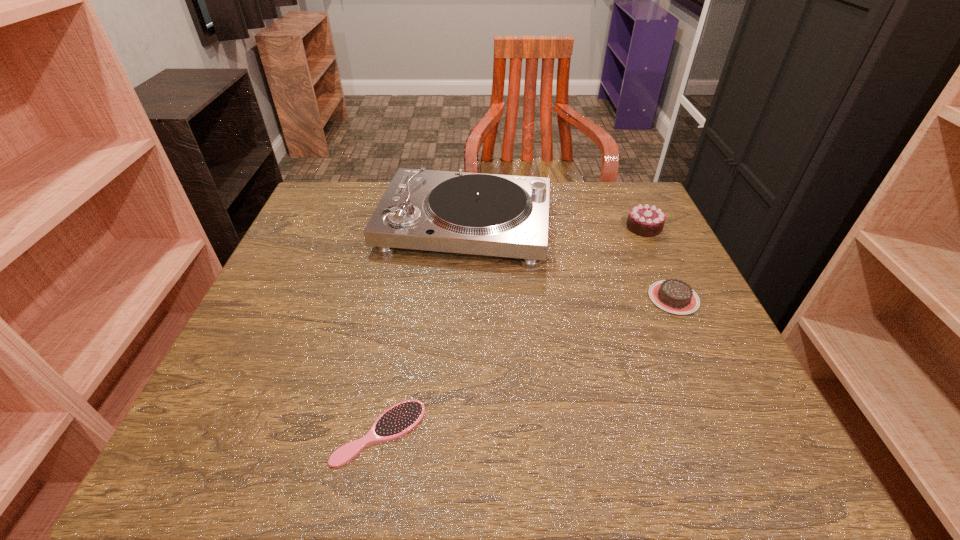
Identify the location of free space between the farther chocolate cake and the record player. (554, 226).

What are the coordinates of `object identified as the second closest to the second shortest object` in the screenshot? It's located at (458, 212).

The width and height of the screenshot is (960, 540). I want to click on the closest object relative to the taller chocolate cake, so click(675, 296).

This screenshot has height=540, width=960. What are the coordinates of `free space in the image that satisfies the following two spatial constraints: 1. on the back side of the tallest object; 2. on the right side of the hairbrush` in the screenshot? It's located at [418, 225].